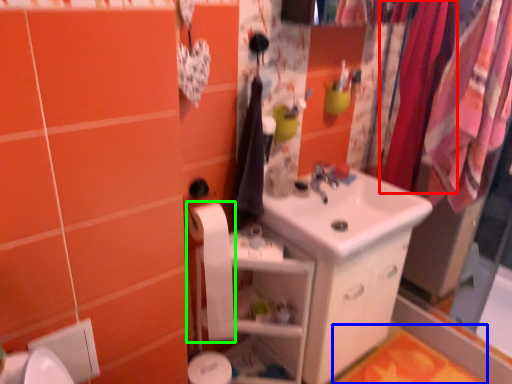
Question: Which object is positioned closest to clothesline (highlighted by a red box)? Select from bath mat (highlighted by a blue box) and toilet paper (highlighted by a green box).

Choices:
 (A) bath mat
 (B) toilet paper

Answer: (B)